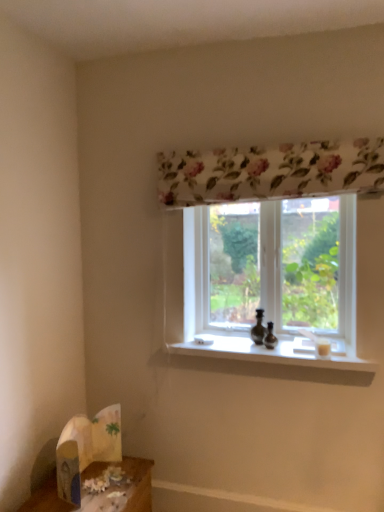
Question: Is the depth of transparent glass window at center less than that of wooden table at lower left?

Choices:
 (A) yes
 (B) no

Answer: (B)

Question: Does transparent glass window at center appear on the right side of wooden table at lower left?

Choices:
 (A) yes
 (B) no

Answer: (A)

Question: From a real-world perspective, is transparent glass window at center located beneath wooden table at lower left?

Choices:
 (A) yes
 (B) no

Answer: (B)

Question: Can you confirm if transparent glass window at center is bigger than wooden table at lower left?

Choices:
 (A) yes
 (B) no

Answer: (B)

Question: Considering the relative sizes of transparent glass window at center and wooden table at lower left in the image provided, is transparent glass window at center taller than wooden table at lower left?

Choices:
 (A) yes
 (B) no

Answer: (A)

Question: Is white paper bag at lower left inside or outside of transparent glass window at center?

Choices:
 (A) inside
 (B) outside

Answer: (B)

Question: From a real-world perspective, is white paper bag at lower left above or below transparent glass window at center?

Choices:
 (A) below
 (B) above

Answer: (A)

Question: Does point (94, 424) appear closer or farther from the camera than point (286, 252)?

Choices:
 (A) closer
 (B) farther

Answer: (A)

Question: Based on their sizes in the image, would you say white paper bag at lower left is bigger or smaller than transparent glass window at center?

Choices:
 (A) big
 (B) small

Answer: (B)

Question: Does point (324, 367) appear closer or farther from the camera than point (92, 449)?

Choices:
 (A) farther
 (B) closer

Answer: (B)

Question: From a real-world perspective, relative to white paper bag at lower left, is white smooth window sill at center vertically above or below?

Choices:
 (A) below
 (B) above

Answer: (B)

Question: Based on their sizes in the image, would you say white smooth window sill at center is bigger or smaller than white paper bag at lower left?

Choices:
 (A) small
 (B) big

Answer: (B)

Question: Would you say white smooth window sill at center is to the left or to the right of white paper bag at lower left in the picture?

Choices:
 (A) right
 (B) left

Answer: (A)

Question: Is white smooth window sill at center inside the boundaries of transparent glass window at center, or outside?

Choices:
 (A) outside
 (B) inside

Answer: (A)

Question: Is white smooth window sill at center to the left or to the right of transparent glass window at center in the image?

Choices:
 (A) left
 (B) right

Answer: (A)